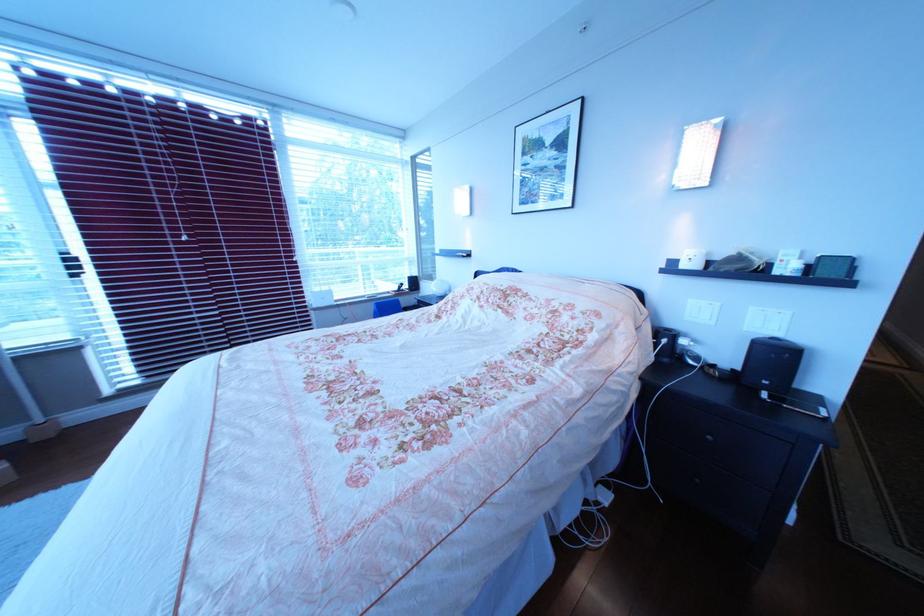
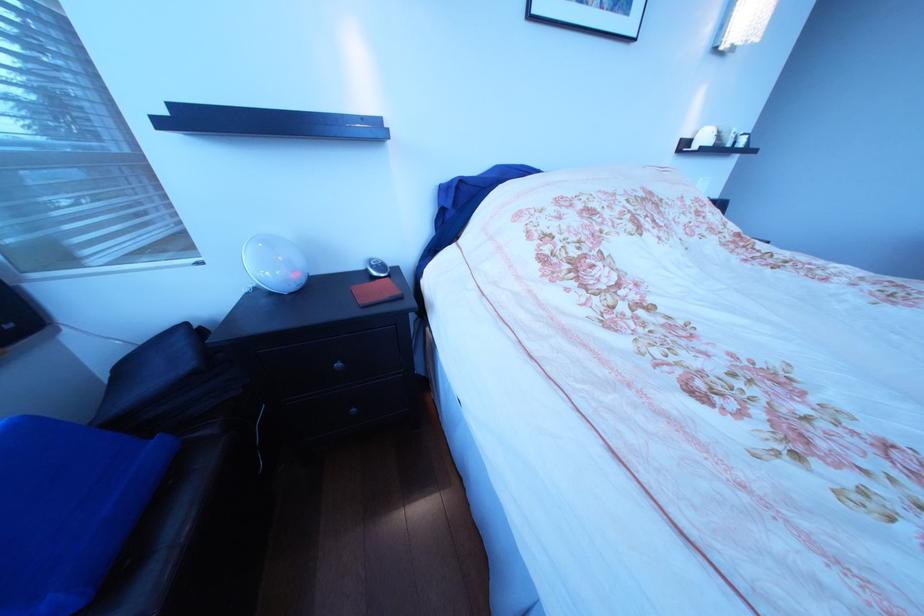
Question: I am providing you with two images of the same scene from different viewpoints. Please identify which objects are invisible in image2.

Choices:
 (A) small white container
 (B) small silver device
 (C) white dome lamp
 (D) none of these

Answer: (D)